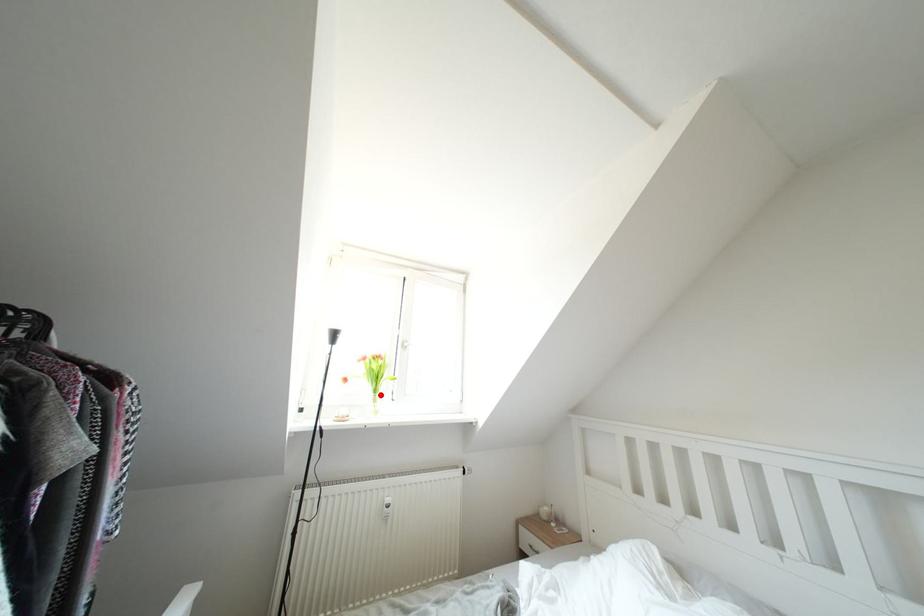
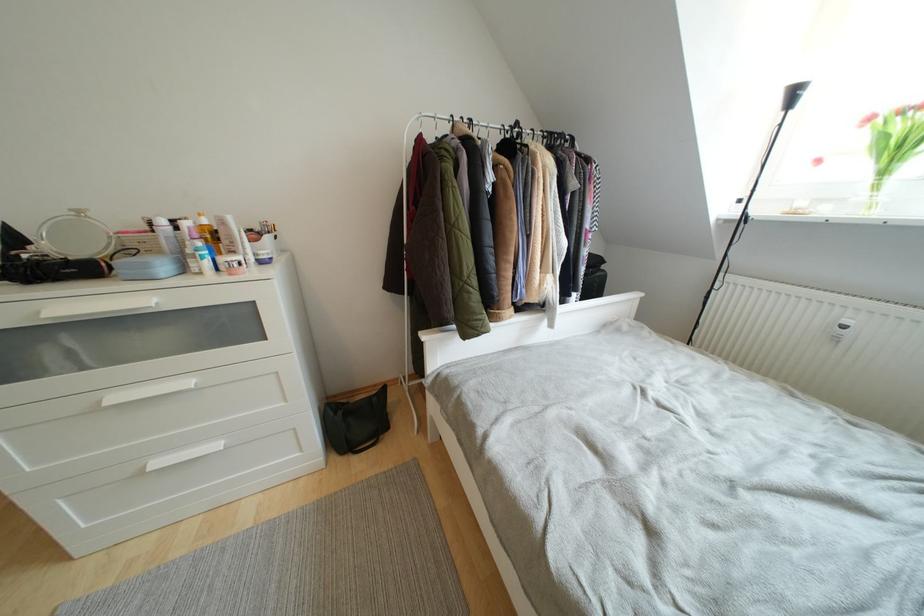
Find the pixel in the second image that matches the highlighted location in the first image.

(890, 176)